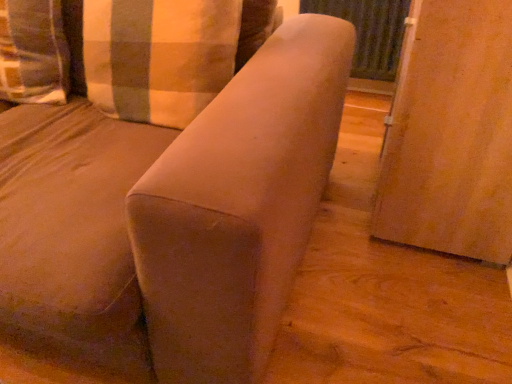
This screenshot has height=384, width=512. What do you see at coordinates (170, 218) in the screenshot? I see `suede-like beige sofa at center` at bounding box center [170, 218].

The height and width of the screenshot is (384, 512). Describe the element at coordinates (370, 38) in the screenshot. I see `matte black radiator at upper right, which is counted as the second screen door, starting from the front` at that location.

What do you see at coordinates (450, 133) in the screenshot? I see `wooden screen door at right, which is counted as the 2th screen door, starting from the back` at bounding box center [450, 133].

The width and height of the screenshot is (512, 384). Identify the location of suede-like beige sofa at center. (170, 218).

Is suede-like beige sofa at center aimed at matte black radiator at upper right, which is counted as the second screen door, starting from the front?

No, suede-like beige sofa at center is not turned towards matte black radiator at upper right, which is counted as the second screen door, starting from the front.

Which of these two, suede-like beige sofa at center or matte black radiator at upper right, the first screen door viewed from the back, is bigger?

suede-like beige sofa at center is bigger.

From the image's perspective, is suede-like beige sofa at center under matte black radiator at upper right, which is counted as the second screen door, starting from the front?

Correct, suede-like beige sofa at center appears lower than matte black radiator at upper right, which is counted as the second screen door, starting from the front, in the image.

Are suede-like beige sofa at center and matte black radiator at upper right, the first screen door viewed from the back, making contact?

suede-like beige sofa at center is not next to matte black radiator at upper right, the first screen door viewed from the back, and they're not touching.

Can you confirm if matte black radiator at upper right, which is counted as the second screen door, starting from the front, is wider than suede-like beige sofa at center?

No.

How far apart are matte black radiator at upper right, which is counted as the second screen door, starting from the front, and suede-like beige sofa at center?

matte black radiator at upper right, which is counted as the second screen door, starting from the front, and suede-like beige sofa at center are 4.43 feet apart.

Does matte black radiator at upper right, the first screen door viewed from the back, have a smaller size compared to suede-like beige sofa at center?

Indeed, matte black radiator at upper right, the first screen door viewed from the back, has a smaller size compared to suede-like beige sofa at center.

Is point (396, 19) less distant than point (266, 142)?

No, it is not.

Is wooden screen door at right, which is counted as the 1th screen door, starting from the front, shorter than suede-like beige sofa at center?

Correct, wooden screen door at right, which is counted as the 1th screen door, starting from the front, is not as tall as suede-like beige sofa at center.

Which is nearer, [465,249] or [33,305]?

Point [465,249] is positioned farther from the camera compared to point [33,305].

What's the angular difference between wooden screen door at right, which is counted as the 2th screen door, starting from the back, and suede-like beige sofa at center's facing directions?

wooden screen door at right, which is counted as the 2th screen door, starting from the back, and suede-like beige sofa at center are facing 89.8 degrees away from each other.

Find the location of a particular element. The image size is (512, 384). furniture located in front of the wooden screen door at right, which is counted as the 1th screen door, starting from the front is located at coordinates (170, 218).

How different are the orientations of plaid fabric pillow at upper left, placed as the first pillow when sorted from left to right, and suede-like beige sofa at center in degrees?

They differ by 6.96 degrees in their facing directions.

Is plaid fabric pillow at upper left, placed as the first pillow when sorted from left to right, to the left of suede-like beige sofa at center from the viewer's perspective?

Correct, you'll find plaid fabric pillow at upper left, placed as the first pillow when sorted from left to right, to the left of suede-like beige sofa at center.

Considering the points (23, 102) and (12, 111), which point is behind, point (23, 102) or point (12, 111)?

Point (23, 102)

Can you confirm if plaid fabric pillow at upper left, which is the second pillow in right-to-left order, is taller than suede-like beige sofa at center?

No, plaid fabric pillow at upper left, which is the second pillow in right-to-left order, is not taller than suede-like beige sofa at center.

Considering the positions of objects suede-like beige sofa at center and wooden screen door at right, which is counted as the 2th screen door, starting from the back, in the image provided, who is behind, suede-like beige sofa at center or wooden screen door at right, which is counted as the 2th screen door, starting from the back,?

wooden screen door at right, which is counted as the 2th screen door, starting from the back, is further from the camera.

Between suede-like beige sofa at center and wooden screen door at right, which is counted as the 2th screen door, starting from the back, which one has smaller size?

With smaller size is wooden screen door at right, which is counted as the 2th screen door, starting from the back.

Which of these two, suede-like beige sofa at center or wooden screen door at right, which is counted as the 1th screen door, starting from the front, stands taller?

suede-like beige sofa at center.

Looking at this image, who is smaller, wooden screen door at right, which is counted as the 1th screen door, starting from the front, or matte black radiator at upper right, the first screen door viewed from the back?

matte black radiator at upper right, the first screen door viewed from the back.

Is wooden screen door at right, which is counted as the 1th screen door, starting from the front, next to matte black radiator at upper right, which is counted as the second screen door, starting from the front, and touching it?

No, wooden screen door at right, which is counted as the 1th screen door, starting from the front, is not touching matte black radiator at upper right, which is counted as the second screen door, starting from the front.

Where is `screen door below the matte black radiator at upper right, which is counted as the second screen door, starting from the front (from the image's perspective)`? The width and height of the screenshot is (512, 384). screen door below the matte black radiator at upper right, which is counted as the second screen door, starting from the front (from the image's perspective) is located at coordinates (450, 133).

Which is more to the left, suede-like beige sofa at center or plaid fabric pillow at upper left, the second pillow in the left-to-right sequence?

Positioned to the left is suede-like beige sofa at center.

This screenshot has height=384, width=512. In order to click on furniture that appears below the plaid fabric pillow at upper left, the second pillow in the left-to-right sequence (from the image's perspective) in this screenshot , I will do `click(170, 218)`.

Which of these two, suede-like beige sofa at center or plaid fabric pillow at upper left, the second pillow in the left-to-right sequence, is smaller?

plaid fabric pillow at upper left, the second pillow in the left-to-right sequence.

Image resolution: width=512 pixels, height=384 pixels. Identify the location of furniture above the matte black radiator at upper right, which is counted as the second screen door, starting from the front (from a real-world perspective). (170, 218).

Where is `screen door that is the 2nd object directly below the suede-like beige sofa at center (from a real-world perspective)`? The height and width of the screenshot is (384, 512). screen door that is the 2nd object directly below the suede-like beige sofa at center (from a real-world perspective) is located at coordinates (370, 38).

Looking at the image, which one is located further to wooden screen door at right, which is counted as the 2th screen door, starting from the back, suede-like beige sofa at center or plaid fabric pillow at upper left, the second pillow in the left-to-right sequence?

plaid fabric pillow at upper left, the second pillow in the left-to-right sequence, is further to wooden screen door at right, which is counted as the 2th screen door, starting from the back.

From the image, which object appears to be farther from matte black radiator at upper right, which is counted as the second screen door, starting from the front, suede-like beige sofa at center or plaid fabric pillow at upper left, the second pillow in the left-to-right sequence?

Based on the image, suede-like beige sofa at center appears to be further to matte black radiator at upper right, which is counted as the second screen door, starting from the front.

Looking at the image, which one is located further to matte black radiator at upper right, which is counted as the second screen door, starting from the front, suede-like beige sofa at center or plaid fabric pillow at upper left, which is the second pillow in right-to-left order?

plaid fabric pillow at upper left, which is the second pillow in right-to-left order, is positioned further to the anchor matte black radiator at upper right, which is counted as the second screen door, starting from the front.

Estimate the real-world distances between objects in this image. Which object is further from plaid fabric pillow at upper left, the second pillow in the left-to-right sequence, matte black radiator at upper right, the first screen door viewed from the back, or wooden screen door at right, which is counted as the 1th screen door, starting from the front?

matte black radiator at upper right, the first screen door viewed from the back, is positioned further to the anchor plaid fabric pillow at upper left, the second pillow in the left-to-right sequence.

Estimate the real-world distances between objects in this image. Which object is closer to plaid fabric pillow at upper left, the second pillow in the left-to-right sequence, plaid fabric pillow at upper left, placed as the first pillow when sorted from left to right, or wooden screen door at right, which is counted as the 2th screen door, starting from the back?

Based on the image, plaid fabric pillow at upper left, placed as the first pillow when sorted from left to right, appears to be nearer to plaid fabric pillow at upper left, the second pillow in the left-to-right sequence.

Considering their positions, is suede-like beige sofa at center positioned closer to matte black radiator at upper right, which is counted as the second screen door, starting from the front, than wooden screen door at right, which is counted as the 2th screen door, starting from the back?

Among the two, wooden screen door at right, which is counted as the 2th screen door, starting from the back, is located nearer to matte black radiator at upper right, which is counted as the second screen door, starting from the front.

Which object lies nearer to the anchor point wooden screen door at right, which is counted as the 1th screen door, starting from the front, suede-like beige sofa at center or plaid fabric pillow at upper left, which is the second pillow in right-to-left order?

suede-like beige sofa at center.

Based on their spatial positions, is plaid fabric pillow at upper left, which is the second pillow in right-to-left order, or suede-like beige sofa at center closer to plaid fabric pillow at upper left, the second pillow in the left-to-right sequence?

The object closer to plaid fabric pillow at upper left, the second pillow in the left-to-right sequence, is suede-like beige sofa at center.

The height and width of the screenshot is (384, 512). What are the coordinates of `pillow between plaid fabric pillow at upper left, which is the second pillow in right-to-left order, and matte black radiator at upper right, the first screen door viewed from the back, from left to right` in the screenshot? It's located at (158, 56).

Locate an element on the screen. pillow between plaid fabric pillow at upper left, which is the second pillow in right-to-left order, and wooden screen door at right, which is counted as the 2th screen door, starting from the back, from left to right is located at coordinates (158, 56).

You are a GUI agent. You are given a task and a screenshot of the screen. Output one action in this format:
    pyautogui.click(x=<x>, y=<y>)
    Task: Click on the screen door between suede-like beige sofa at center and matte black radiator at upper right, which is counted as the second screen door, starting from the front, along the z-axis
    The image size is (512, 384).
    Given the screenshot: What is the action you would take?
    pyautogui.click(x=450, y=133)

Locate an element on the screen. pillow between suede-like beige sofa at center and wooden screen door at right, which is counted as the 1th screen door, starting from the front, in the horizontal direction is located at coordinates (158, 56).